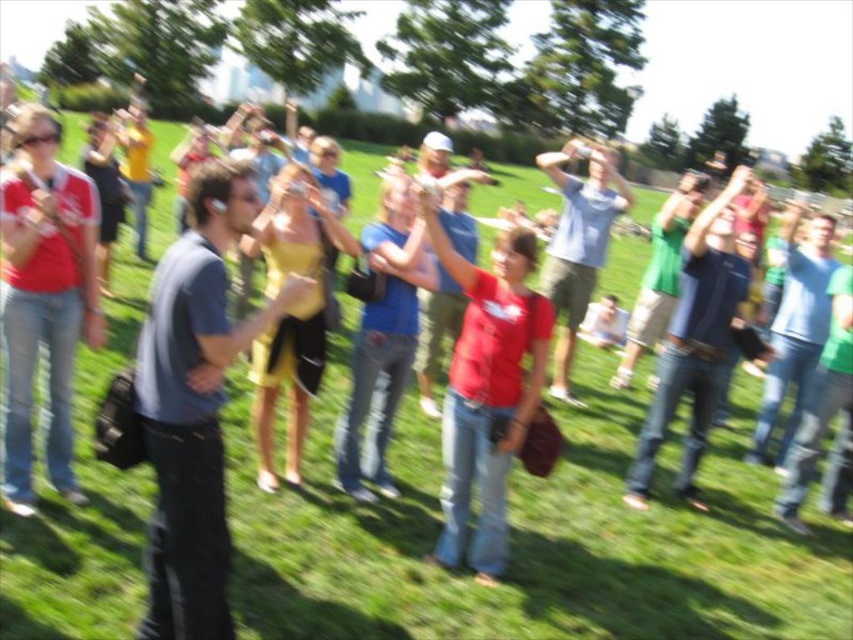
Is point (24, 304) closer to camera compared to point (479, 291)?

Yes, point (24, 304) is closer to viewer.

Is point (54, 291) less distant than point (496, 442)?

No, it is not.

I want to click on matte red shirt at left, so click(x=44, y=296).

Is matte red shirt at center wider than yellow satin dress at center?

Incorrect, matte red shirt at center's width does not surpass yellow satin dress at center's.

Can you confirm if matte red shirt at center is shorter than yellow satin dress at center?

No.

Identify the location of matte red shirt at center. (486, 388).

Where is `matte red shirt at center`? Image resolution: width=853 pixels, height=640 pixels. matte red shirt at center is located at coordinates (486, 388).

The height and width of the screenshot is (640, 853). I want to click on dark gray shirt at center, so click(x=195, y=403).

Which is behind, point (154, 355) or point (289, 209)?

The point (289, 209) is more distant.

Does point (187, 230) lie in front of point (323, 275)?

No, it is behind (323, 275).

The width and height of the screenshot is (853, 640). I want to click on dark gray shirt at center, so click(x=195, y=403).